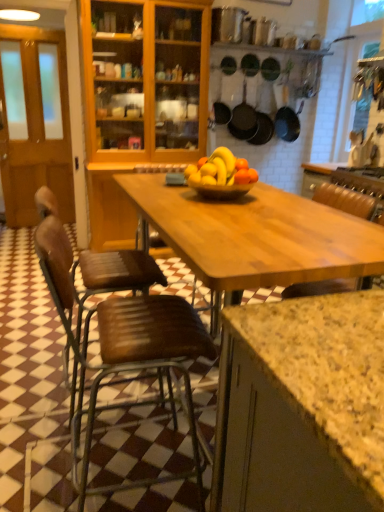
Question: Is black matte frying pan at center, positioned as the 4th frying pan in right-to-left order, not close to matte black frying pan at upper center, the second frying pan in the right-to-left sequence?

Choices:
 (A) no
 (B) yes

Answer: (A)

Question: Is black matte frying pan at center, placed as the 1th frying pan when sorted from left to right, taller than matte black frying pan at upper center, the second frying pan in the right-to-left sequence?

Choices:
 (A) yes
 (B) no

Answer: (B)

Question: From the image's perspective, is black matte frying pan at center, positioned as the 4th frying pan in right-to-left order, below matte black frying pan at upper center, the second frying pan in the right-to-left sequence?

Choices:
 (A) no
 (B) yes

Answer: (A)

Question: Is black matte frying pan at center, positioned as the 4th frying pan in right-to-left order, looking in the opposite direction of matte black frying pan at upper center, which appears as the 3th frying pan when viewed from the left?

Choices:
 (A) no
 (B) yes

Answer: (A)

Question: From the image's perspective, is black matte frying pan at center, placed as the 1th frying pan when sorted from left to right, above matte black frying pan at upper center, the second frying pan in the right-to-left sequence?

Choices:
 (A) yes
 (B) no

Answer: (A)

Question: Choose the correct answer: Is brown wooden chair at lower left, marked as the first chair in a front-to-back arrangement, inside brown wooden door at left or outside it?

Choices:
 (A) inside
 (B) outside

Answer: (B)

Question: In the image, is brown wooden chair at lower left, marked as the first chair in a front-to-back arrangement, on the left side or the right side of brown wooden door at left?

Choices:
 (A) left
 (B) right

Answer: (B)

Question: From a real-world perspective, is brown wooden chair at lower left, which appears as the 2th chair when viewed from the back, above or below brown wooden door at left?

Choices:
 (A) below
 (B) above

Answer: (A)

Question: Is point (187, 402) closer or farther from the camera than point (64, 187)?

Choices:
 (A) farther
 (B) closer

Answer: (B)

Question: Do you think black matte frying pan at center, positioned as the 4th frying pan in right-to-left order, is within matte black frying pan at center, the third frying pan from the right, or outside of it?

Choices:
 (A) outside
 (B) inside

Answer: (A)

Question: In the image, is black matte frying pan at center, placed as the 1th frying pan when sorted from left to right, on the left side or the right side of matte black frying pan at center, the third frying pan from the right?

Choices:
 (A) left
 (B) right

Answer: (A)

Question: Is point (211, 76) positioned closer to the camera than point (231, 126)?

Choices:
 (A) closer
 (B) farther

Answer: (A)

Question: In terms of size, does black matte frying pan at center, positioned as the 4th frying pan in right-to-left order, appear bigger or smaller than matte black frying pan at center, the second frying pan viewed from the left?

Choices:
 (A) small
 (B) big

Answer: (A)

Question: Is matte black frying pan at upper center, which appears as the 3th frying pan when viewed from the left, inside or outside of translucent glass bowl at center?

Choices:
 (A) inside
 (B) outside

Answer: (B)

Question: Considering the positions of matte black frying pan at upper center, which appears as the 3th frying pan when viewed from the left, and translucent glass bowl at center in the image, is matte black frying pan at upper center, which appears as the 3th frying pan when viewed from the left, wider or thinner than translucent glass bowl at center?

Choices:
 (A) thin
 (B) wide

Answer: (A)